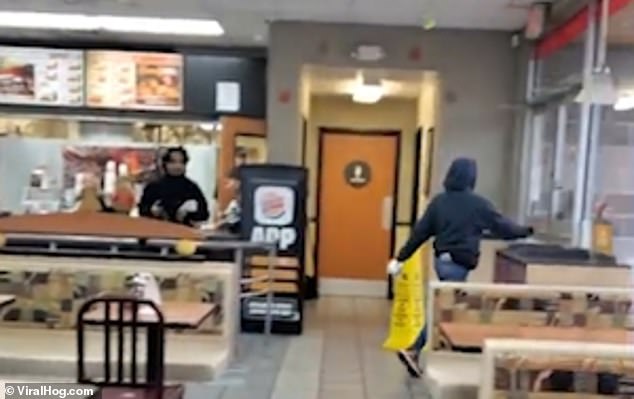
Identify the location of floor. The image size is (634, 399). (290, 391).